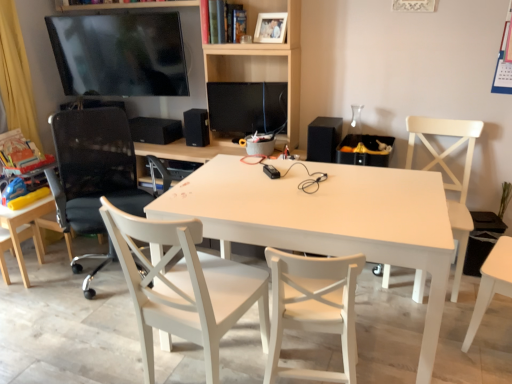
Question: Is white wood chair at center, which is the 4th chair from left to right, facing away from black matte speaker at center, which is counted as the second speaker, starting from the right?

Choices:
 (A) no
 (B) yes

Answer: (A)

Question: From the image's perspective, is white wood chair at center, which is the 4th chair from left to right, over black matte speaker at center, the 2th speaker viewed from the back?

Choices:
 (A) no
 (B) yes

Answer: (A)

Question: Would you say white wood chair at center, which ranks as the second chair in right-to-left order, is outside black matte speaker at center, which is counted as the second speaker, starting from the right?

Choices:
 (A) yes
 (B) no

Answer: (A)

Question: Is white wood chair at center, which ranks as the second chair in right-to-left order, further to camera compared to black matte speaker at center, acting as the second speaker starting from the left?

Choices:
 (A) yes
 (B) no

Answer: (B)

Question: Is white wood chair at center, which is the 4th chair from left to right, to the left of black matte speaker at center, acting as the second speaker starting from the left, from the viewer's perspective?

Choices:
 (A) no
 (B) yes

Answer: (A)

Question: From the image's perspective, is white wood chair at center, which ranks as the second chair in right-to-left order, located beneath black matte speaker at center, the 2th speaker positioned from the front?

Choices:
 (A) yes
 (B) no

Answer: (A)

Question: Can you confirm if white wood chair at center, which ranks as the second chair in right-to-left order, is wider than white matte table at center?

Choices:
 (A) no
 (B) yes

Answer: (A)

Question: Could you tell me if white wood chair at center, which is the 4th chair from left to right, is turned towards white matte table at center?

Choices:
 (A) no
 (B) yes

Answer: (B)

Question: Is white matte table at center at the back of white wood chair at center, which is the 4th chair from left to right?

Choices:
 (A) yes
 (B) no

Answer: (B)

Question: Is white wood chair at center, which is the 4th chair from left to right, thinner than white matte table at center?

Choices:
 (A) no
 (B) yes

Answer: (B)

Question: Does white wood chair at center, which is the 4th chair from left to right, have a smaller size compared to white matte table at center?

Choices:
 (A) yes
 (B) no

Answer: (A)

Question: Is there a large distance between white wood chair at center, which is the 4th chair from left to right, and white matte table at center?

Choices:
 (A) yes
 (B) no

Answer: (B)

Question: Is matte black monitor at center looking in the opposite direction of black mesh office chair at left, marked as the 4th chair in a right-to-left arrangement?

Choices:
 (A) no
 (B) yes

Answer: (A)